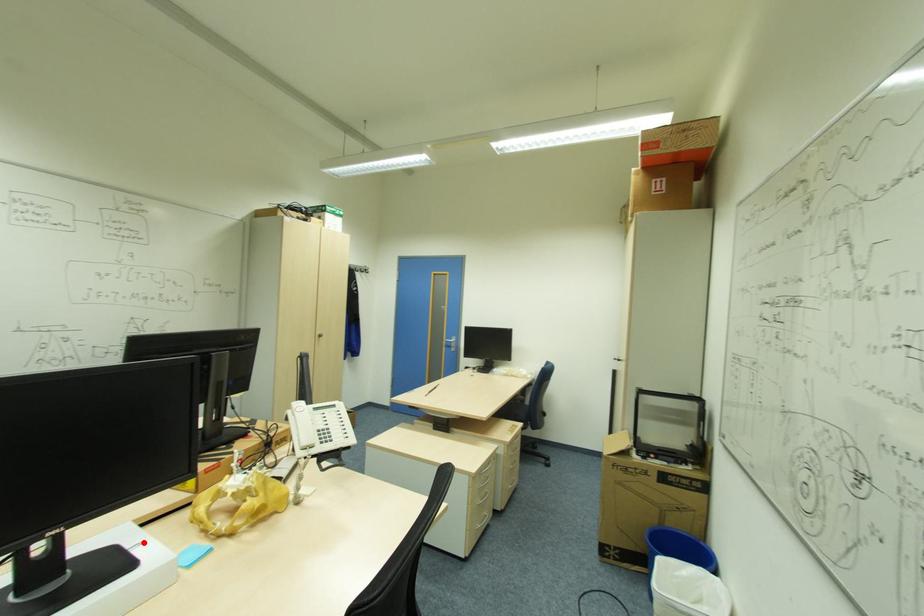
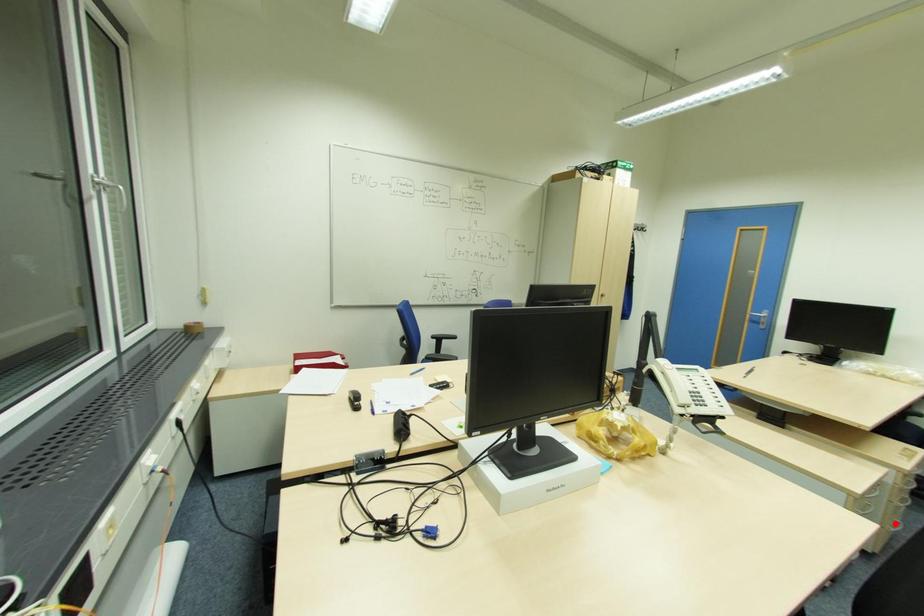
I am providing you with two images of the same scene from different viewpoints. A red point is marked on the first image and another point is marked on the second image. Is the red point in image1 aligned with the point shown in image2?

No